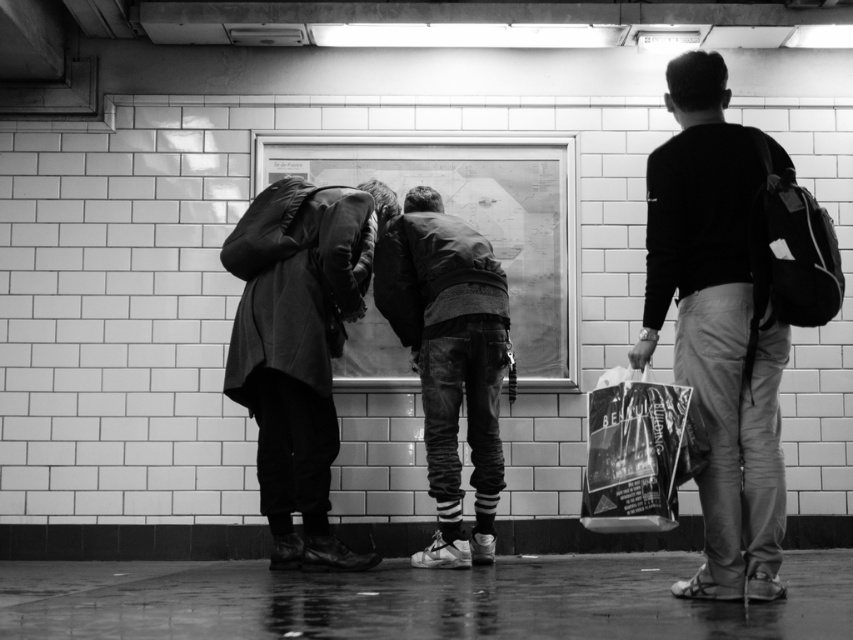
Question: Which point is farther to the camera?

Choices:
 (A) (331, 241)
 (B) (433, 308)

Answer: (B)

Question: Which point is farther to the camera?

Choices:
 (A) (444, 307)
 (B) (260, 333)

Answer: (A)

Question: Does denim jeans at center have a smaller size compared to shiny plastic bag at right?

Choices:
 (A) no
 (B) yes

Answer: (A)

Question: Is dark gray sweater at right behind cozy woolen coat at center?

Choices:
 (A) no
 (B) yes

Answer: (A)

Question: Which object appears farthest from the camera in this image?

Choices:
 (A) dark gray sweater at right
 (B) denim jeans at center
 (C) cozy woolen coat at center

Answer: (B)

Question: In this image, where is dark gray sweater at right located relative to cozy woolen coat at center?

Choices:
 (A) below
 (B) above

Answer: (B)